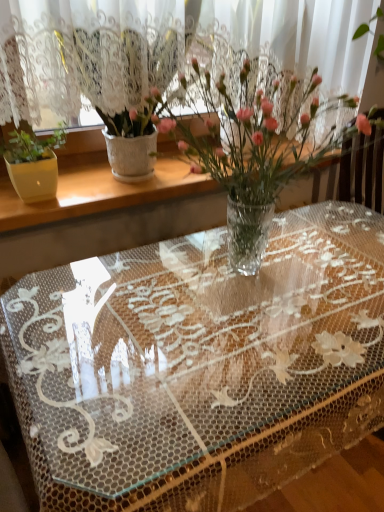
Question: Is white textured vase at upper left thinner than transparent lace tablecloth at center?

Choices:
 (A) yes
 (B) no

Answer: (A)

Question: From the image's perspective, would you say white textured vase at upper left is shown under transparent lace tablecloth at center?

Choices:
 (A) yes
 (B) no

Answer: (B)

Question: Considering the relative sizes of white textured vase at upper left and transparent lace tablecloth at center in the image provided, is white textured vase at upper left shorter than transparent lace tablecloth at center?

Choices:
 (A) no
 (B) yes

Answer: (B)

Question: From a real-world perspective, is white textured vase at upper left under transparent lace tablecloth at center?

Choices:
 (A) yes
 (B) no

Answer: (B)

Question: From a real-world perspective, is white textured vase at upper left over transparent lace tablecloth at center?

Choices:
 (A) no
 (B) yes

Answer: (B)

Question: Is white textured vase at upper left to the left of transparent lace tablecloth at center from the viewer's perspective?

Choices:
 (A) yes
 (B) no

Answer: (A)

Question: From a real-world perspective, is clear plastic vase at center, the 2th houseplant viewed from the left, on top of white textured vase at upper left?

Choices:
 (A) yes
 (B) no

Answer: (A)

Question: Does clear plastic vase at center, the 2th houseplant viewed from the left, turn towards white textured vase at upper left?

Choices:
 (A) yes
 (B) no

Answer: (B)

Question: Considering the relative sizes of clear plastic vase at center, positioned as the first houseplant in right-to-left order, and white textured vase at upper left in the image provided, is clear plastic vase at center, positioned as the first houseplant in right-to-left order, bigger than white textured vase at upper left?

Choices:
 (A) yes
 (B) no

Answer: (A)

Question: Does clear plastic vase at center, the 2th houseplant viewed from the left, have a greater height compared to white textured vase at upper left?

Choices:
 (A) no
 (B) yes

Answer: (B)

Question: From the image's perspective, is clear plastic vase at center, positioned as the first houseplant in right-to-left order, on white textured vase at upper left?

Choices:
 (A) yes
 (B) no

Answer: (B)

Question: Is clear plastic vase at center, the 2th houseplant viewed from the left, not near white textured vase at upper left?

Choices:
 (A) no
 (B) yes

Answer: (A)

Question: From the image's perspective, would you say white textured vase at upper left is shown under clear plastic vase at center, positioned as the first houseplant in right-to-left order?

Choices:
 (A) no
 (B) yes

Answer: (A)